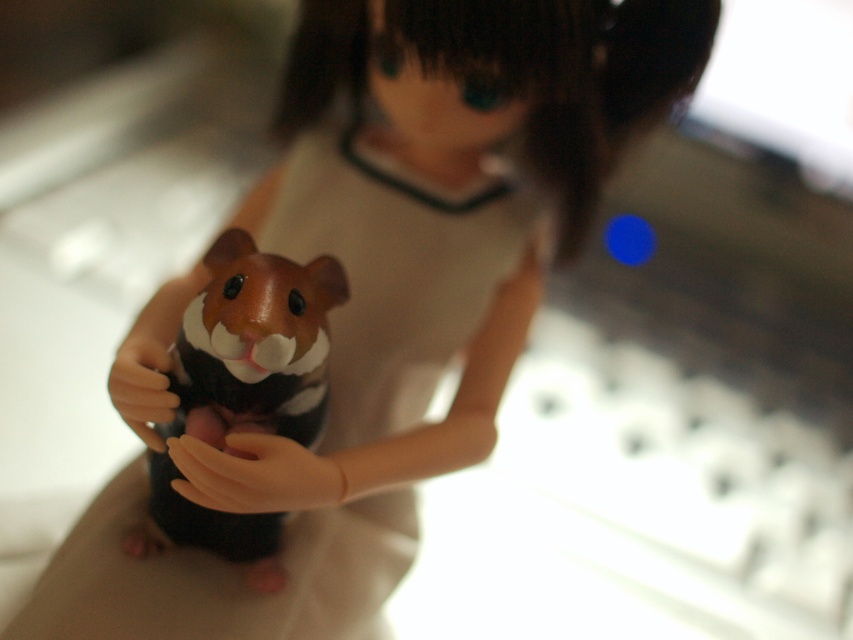
You are a robotic arm trying to pick up the brown matte hamster at center. The robotic arm can only reach objects within 3 inches. Based on the scene, can you reach the hamster from the smooth beige hand at center?

The distance between the brown matte hamster at center and the smooth beige hand at center is 3.11 inches, which is slightly beyond the robotic arm reach limit of 3 inches. Therefore, the robotic arm cannot reach the hamster from the smooth beige hand at center.

You are a photographer adjusting the focus on your camera. You notice two points in the image at coordinates point (316, 288) and point (315, 488). Which point should you focus on to ensure the doll and hamster figurine are sharp, considering their positions relative to each other?

You should focus on point (315, 488) because it is in front of point (316, 288), and focusing on the closer point will help keep the doll and hamster figurine sharp.

You are a photographer adjusting the focus on a camera. You notice the brown matte hamster at center and the smooth beige hand at center in your frame. Which object should you focus on to ensure the hamster is sharp while keeping the hand slightly blurred?

To ensure the brown matte hamster at center is sharp while keeping the smooth beige hand at center slightly blurred, focus on the hamster since it is closer to the viewer than the hand.